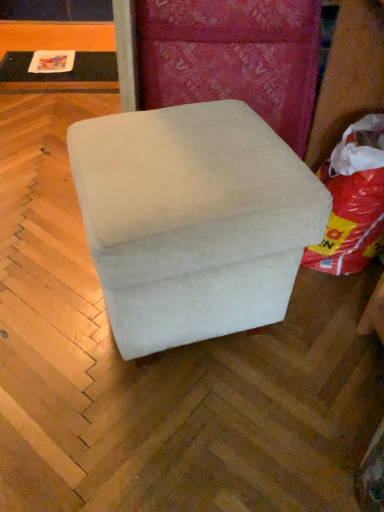
Locate an element on the screen. vacant region above white fabric ottoman at center (from a real-world perspective) is located at coordinates (181, 147).